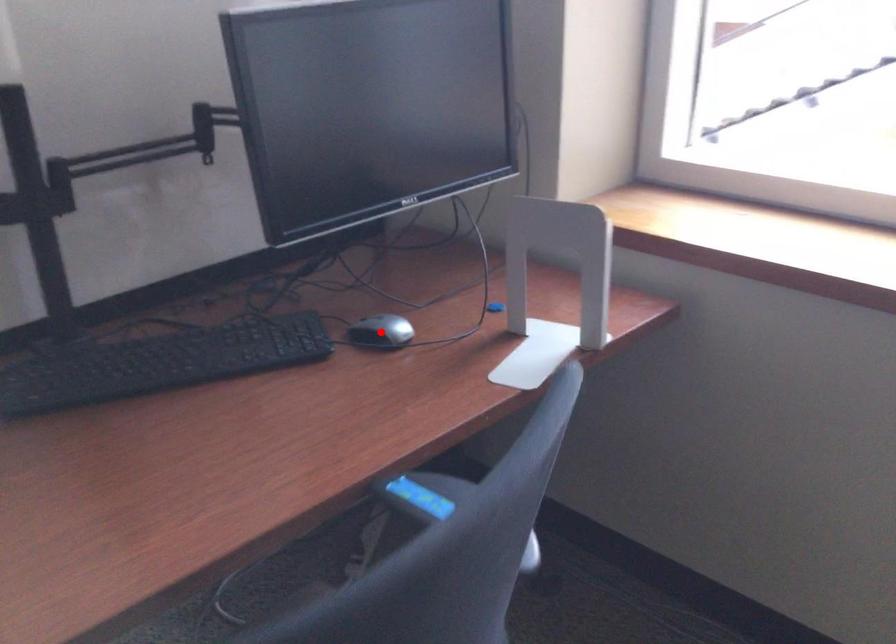
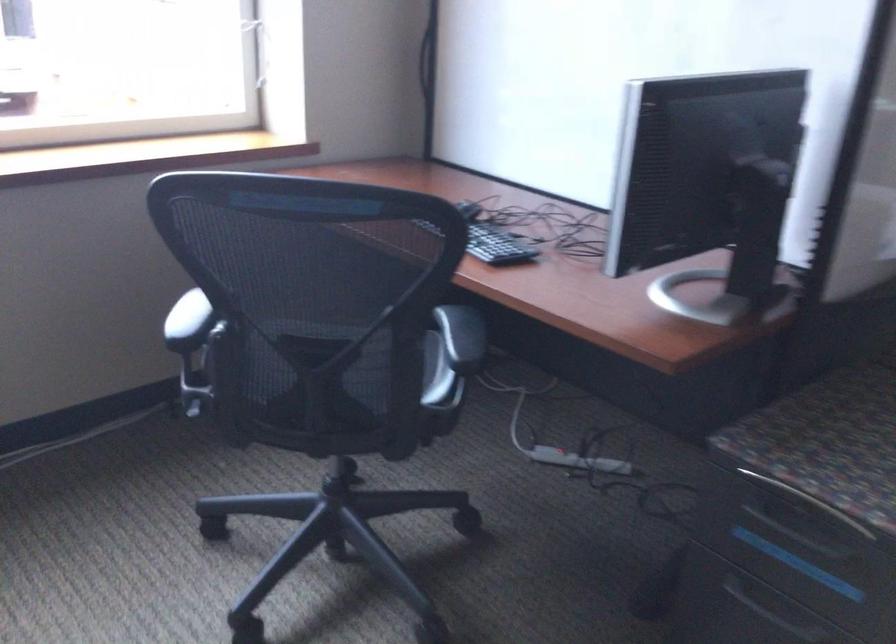
Question: I am providing you with two images of the same scene from different viewpoints. A red point is marked on the first image. Can you still see the location of the red point in image 2?

Choices:
 (A) Yes
 (B) No

Answer: (B)